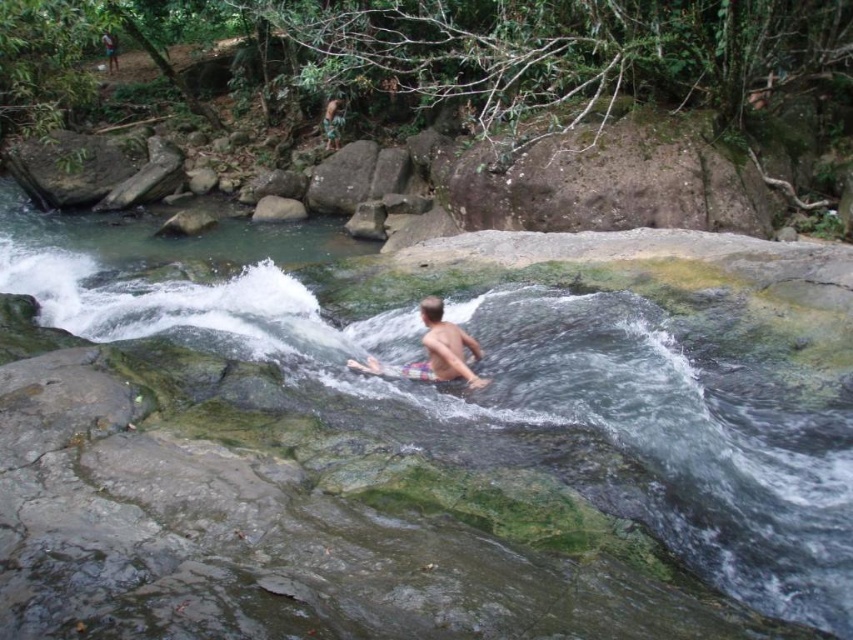
You are trying to cross the river safely. You see the clear water at stream center and the plaid shorts at center. Which object is closer to the surface of the water?

The clear water at stream center is located above the plaid shorts at center, so the clear water at stream center is closer to the surface of the water.

You are standing at the point closer to the camera in the rocky riverbed scene. Which point are you at, point [608,316] or point [460,340]?

You are at point [608,316] because it is further to the camera than point [460,340].

You are trying to cross the river safely. The clear water at stream center and the plaid shorts at center are in your path. Which one should you avoid stepping on to ensure stability?

You should avoid stepping on the clear water at stream center because it is larger in size than the plaid shorts at center, making it less stable to walk on.